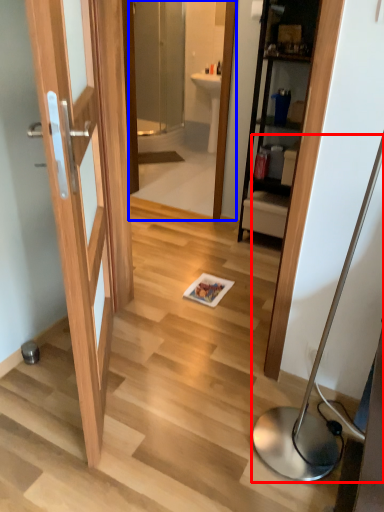
Question: Which object appears farthest to the camera in this image, table lamp (highlighted by a red box) or mirror (highlighted by a blue box)?

Choices:
 (A) table lamp
 (B) mirror

Answer: (B)